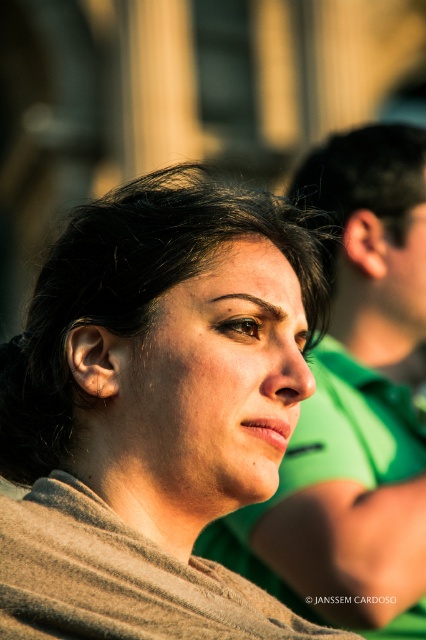
Question: Which point is closer to the camera?

Choices:
 (A) (227, 320)
 (B) (331, 611)
 (C) (256, 237)

Answer: (A)

Question: Is matte gray scarf at center smaller than green fabric shirt at right?

Choices:
 (A) yes
 (B) no

Answer: (B)

Question: Is green fabric shirt at right positioned before matte black forehead at upper center?

Choices:
 (A) yes
 (B) no

Answer: (B)

Question: Which of the following is the farthest from the observer?

Choices:
 (A) click(x=249, y=273)
 (B) click(x=204, y=488)

Answer: (A)

Question: Can you confirm if matte gray scarf at center is bigger than dark brown hair at upper center?

Choices:
 (A) no
 (B) yes

Answer: (B)

Question: Which object is closer to the camera taking this photo?

Choices:
 (A) green fabric shirt at right
 (B) matte black forehead at upper center

Answer: (B)